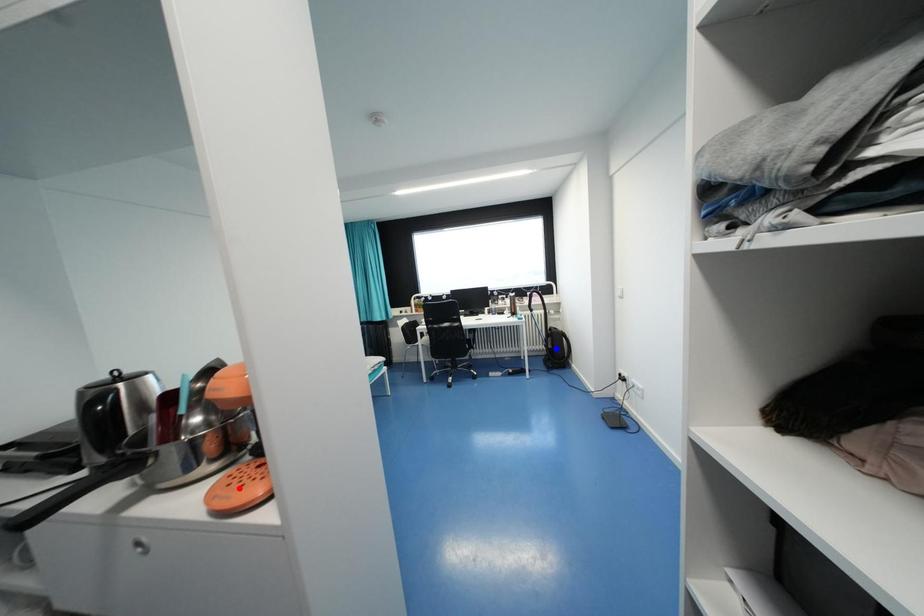
Question: Two points are marked on the image. Which point is closer to the camera?

Choices:
 (A) Blue point is closer.
 (B) Red point is closer.

Answer: (B)